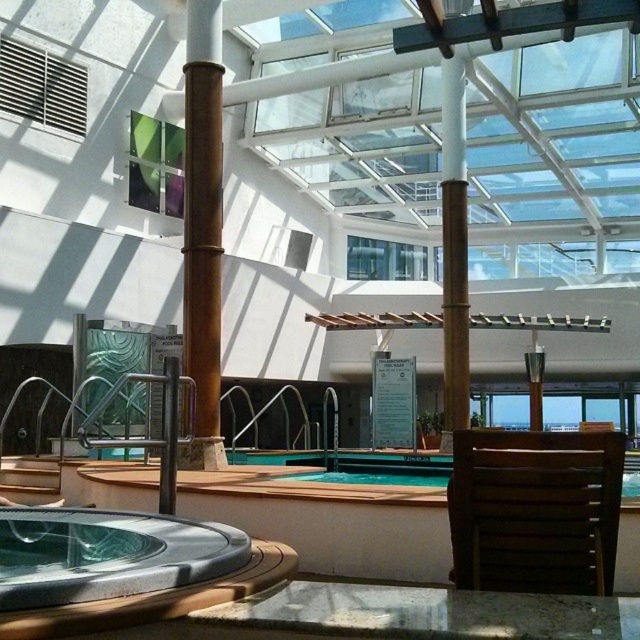
Question: Which object is farther from the camera taking this photo?

Choices:
 (A) brown wooden chair at center
 (B) smooth gray hot tub at lower left
 (C) brown polished wood beam at center

Answer: (C)

Question: Can you confirm if brown polished wood pillar at center is positioned below brown polished wood beam at center?

Choices:
 (A) yes
 (B) no

Answer: (B)

Question: Does smooth gray hot tub at lower left have a smaller size compared to brown polished wood pillar at center?

Choices:
 (A) no
 (B) yes

Answer: (B)

Question: Among these objects, which one is nearest to the camera?

Choices:
 (A) brown wooden chair at center
 (B) brown polished wood pillar at center

Answer: (A)

Question: Which point is closer to the camera?

Choices:
 (A) (17, 596)
 (B) (212, 362)
 (C) (445, 100)
 (D) (465, 460)

Answer: (A)

Question: Is brown wooden chair at center to the right of brown polished wood beam at center from the viewer's perspective?

Choices:
 (A) no
 (B) yes

Answer: (A)